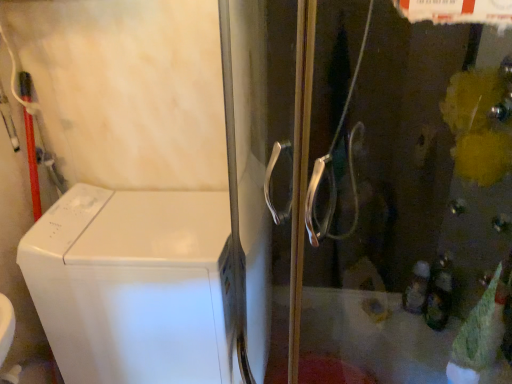
You are a GUI agent. You are given a task and a screenshot of the screen. Output one action in this format:
    pyautogui.click(x=<x>, y=<y>)
    Task: Click on the white glossy washing machine at left
    This screenshot has height=384, width=512.
    Given the screenshot: What is the action you would take?
    (134, 285)

What do you see at coordinates (134, 285) in the screenshot?
I see `white glossy washing machine at left` at bounding box center [134, 285].

Measure the distance between white glossy washing machine at left and camera.

white glossy washing machine at left and camera are 1.18 meters apart.

Image resolution: width=512 pixels, height=384 pixels. Identify the location of transparent glass screen door at center. (429, 169).

The height and width of the screenshot is (384, 512). What do you see at coordinates (429, 169) in the screenshot?
I see `transparent glass screen door at center` at bounding box center [429, 169].

The image size is (512, 384). I want to click on white glossy washing machine at left, so click(134, 285).

Looking at this image, which is more to the right, transparent glass screen door at center or white glossy washing machine at left?

transparent glass screen door at center.

Is the position of transparent glass screen door at center less distant than that of white glossy washing machine at left?

Yes, it is in front of white glossy washing machine at left.

Which is nearer, (426,272) or (64,245)?

The point (64,245) is more forward.

From the image's perspective, who appears lower, transparent glass screen door at center or white glossy washing machine at left?

From the image's view, white glossy washing machine at left is below.

From a real-world perspective, is transparent glass screen door at center physically located above or below white glossy washing machine at left?

From a real-world perspective, transparent glass screen door at center is physically above white glossy washing machine at left.

Can you confirm if transparent glass screen door at center is wider than white glossy washing machine at left?

Yes.

In terms of height, does transparent glass screen door at center look taller or shorter compared to white glossy washing machine at left?

transparent glass screen door at center is taller than white glossy washing machine at left.

Who is smaller, transparent glass screen door at center or white glossy washing machine at left?

Smaller between the two is white glossy washing machine at left.

Is white glossy washing machine at left inside transparent glass screen door at center?

No, white glossy washing machine at left is not surrounded by transparent glass screen door at center.

Are transparent glass screen door at center and white glossy washing machine at left located far from each other?

No.

Is transparent glass screen door at center aimed at white glossy washing machine at left?

No, transparent glass screen door at center is not aimed at white glossy washing machine at left.

Looking at this image, can you tell me how much transparent glass screen door at center and white glossy washing machine at left differ in facing direction?

They differ by 6.19 degrees in their facing directions.

Find the location of a particular element. The width and height of the screenshot is (512, 384). home appliance on the left of transparent glass screen door at center is located at coordinates (134, 285).

Visually, is white glossy washing machine at left positioned to the left or to the right of transparent glass screen door at center?

From the image, it's evident that white glossy washing machine at left is to the left of transparent glass screen door at center.

Which object is more forward, white glossy washing machine at left or transparent glass screen door at center?

transparent glass screen door at center is closer to the camera.

Is point (97, 265) positioned behind point (413, 199)?

No, (97, 265) is in front of (413, 199).

In the scene shown: From the image's perspective, is white glossy washing machine at left located above or below transparent glass screen door at center?

white glossy washing machine at left is situated lower than transparent glass screen door at center in the image.

From a real-world perspective, who is located higher, white glossy washing machine at left or transparent glass screen door at center?

From a 3D spatial view, transparent glass screen door at center is above.

Is white glossy washing machine at left wider or thinner than transparent glass screen door at center?

Considering their sizes, white glossy washing machine at left looks slimmer than transparent glass screen door at center.

Which of these two, white glossy washing machine at left or transparent glass screen door at center, stands taller?

With more height is transparent glass screen door at center.

Does white glossy washing machine at left have a smaller size compared to transparent glass screen door at center?

Yes, white glossy washing machine at left is smaller than transparent glass screen door at center.

Do you think white glossy washing machine at left is within transparent glass screen door at center, or outside of it?

white glossy washing machine at left is located beyond the bounds of transparent glass screen door at center.

Is white glossy washing machine at left touching transparent glass screen door at center?

There is a gap between white glossy washing machine at left and transparent glass screen door at center.

Could you tell me if white glossy washing machine at left is facing transparent glass screen door at center?

No, white glossy washing machine at left is not facing towards transparent glass screen door at center.

Measure the distance between white glossy washing machine at left and transparent glass screen door at center.

17.36 inches.

Identify the location of home appliance below the transparent glass screen door at center (from a real-world perspective). This screenshot has width=512, height=384. point(134,285).

Locate an element on the screen. screen door in front of the white glossy washing machine at left is located at coordinates (429, 169).

This screenshot has width=512, height=384. I want to click on screen door that is above the white glossy washing machine at left (from a real-world perspective), so click(x=429, y=169).